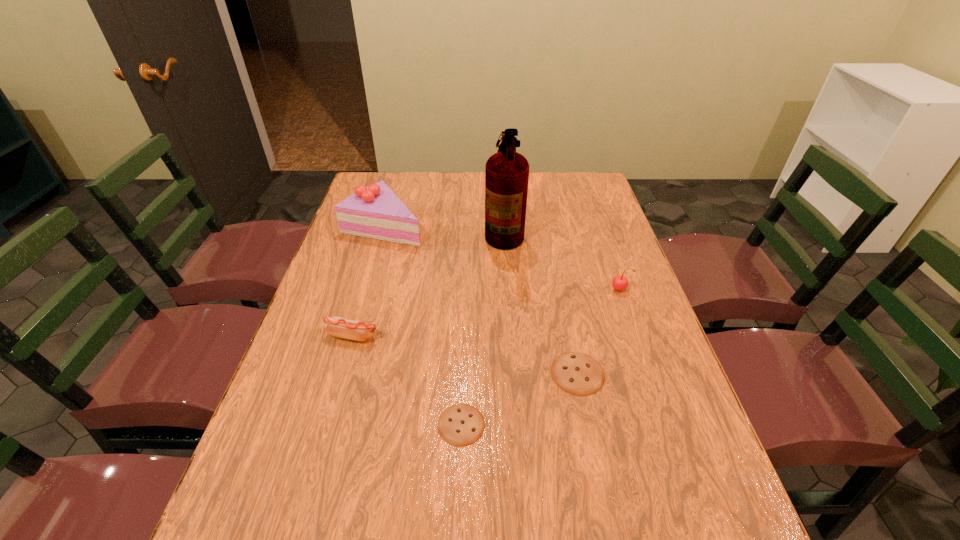
Identify the location of free spot between the fifth farthest object and the cake. The width and height of the screenshot is (960, 540). pos(481,300).

At what (x,y) coordinates should I click in order to perform the action: click on empty space between the rightmost object and the nearer cookie. Please return your answer as a coordinate pair (x, y). Looking at the image, I should click on (540, 357).

The height and width of the screenshot is (540, 960). Find the location of `free space between the sausage and the second nearest object`. free space between the sausage and the second nearest object is located at coordinates (466, 355).

Locate an element on the screen. free space between the fifth tallest object and the cherry is located at coordinates (598, 332).

Locate an element on the screen. The image size is (960, 540). free space between the sausage and the cake is located at coordinates (369, 281).

The image size is (960, 540). What are the coordinates of `unoccupied area between the fourth shortest object and the fourth object from left to right` in the screenshot? It's located at (562, 260).

Identify the location of vacant area that lies between the rightmost object and the cake. (x=501, y=258).

Identify the location of unoccupied area between the sausage and the second shortest object. (466, 355).

Locate an element on the screen. The image size is (960, 540). free spot between the farther cookie and the cake is located at coordinates (481, 300).

Locate an element on the screen. The height and width of the screenshot is (540, 960). vacant area that lies between the rightmost object and the fifth shortest object is located at coordinates (501, 258).